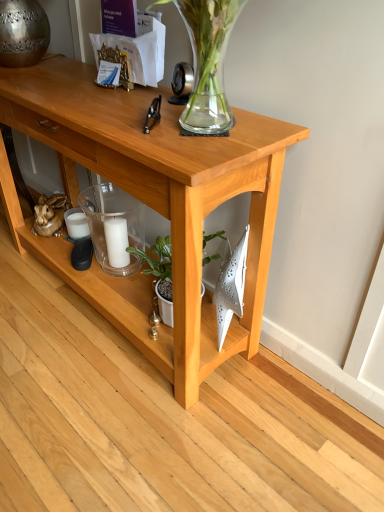
Question: From a real-world perspective, is light wood table at center positioned above or below white matte candle at center?

Choices:
 (A) below
 (B) above

Answer: (B)

Question: Considering the positions of light wood table at center and white matte candle at center in the image, is light wood table at center taller or shorter than white matte candle at center?

Choices:
 (A) short
 (B) tall

Answer: (B)

Question: Which object is the farthest from the green matte plant at center?

Choices:
 (A) light wood table at center
 (B) white matte candle at center
 (C) transparent glass candle at center

Answer: (A)

Question: Which object is positioned farthest from the green matte plant at center?

Choices:
 (A) light wood table at center
 (B) transparent glass candle at center
 (C) white matte candle at center

Answer: (A)